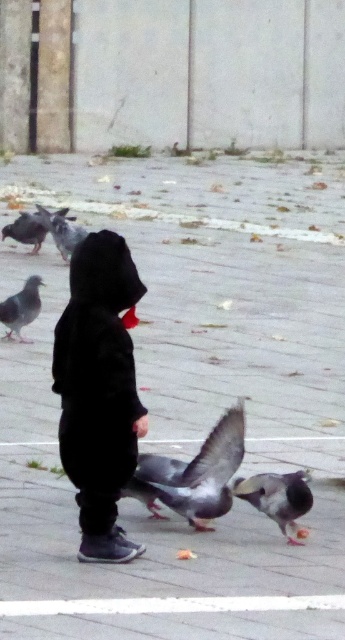
Question: Where is gray matte pigeon at center located in relation to gray matte pigeon at left in the image?

Choices:
 (A) right
 (B) left

Answer: (A)

Question: Which point is farther from the camera taking this photo?

Choices:
 (A) (77, 227)
 (B) (20, 291)
 (C) (232, 420)
 (D) (271, 477)

Answer: (A)

Question: Among these objects, which one is farthest from the camera?

Choices:
 (A) gray matte pigeon at upper left
 (B) gray matte pigeon at center

Answer: (A)

Question: Where is gray matte pigeon at center located in relation to gray matte pigeon at lower center in the image?

Choices:
 (A) right
 (B) left

Answer: (B)

Question: Which of the following is the closest to the observer?

Choices:
 (A) gray matte pigeon at left
 (B) gray matte pigeon at lower center
 (C) black matte hoodie at center
 (D) gray matte pigeon at center

Answer: (C)

Question: Does gray matte pigeon at lower center have a lesser width compared to gray matte pigeon at upper left?

Choices:
 (A) yes
 (B) no

Answer: (A)